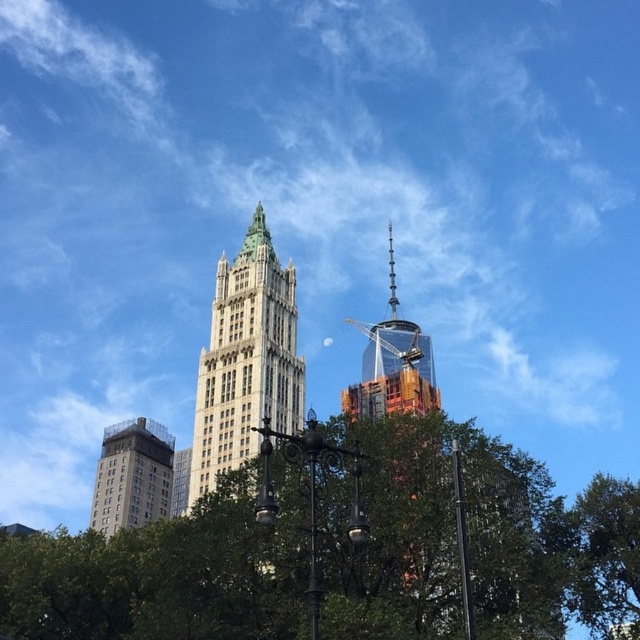
Does green leafy tree at center appear over white stone tower at center?

No, green leafy tree at center is not above white stone tower at center.

Who is higher up, green leafy tree at center or white stone tower at center?

white stone tower at center is higher up.

Find the location of a particular element. Image resolution: width=640 pixels, height=640 pixels. green leafy tree at center is located at coordinates (472, 540).

I want to click on green leafy tree at center, so click(x=472, y=540).

Looking at this image, does white stone tower at center have a greater width compared to orange glass tower at upper center?

Correct, the width of white stone tower at center exceeds that of orange glass tower at upper center.

Where is `white stone tower at center`? The image size is (640, 640). white stone tower at center is located at coordinates (246, 360).

Which is below, green leafy tree at center or orange glass tower at upper center?

green leafy tree at center is below.

From the picture: Does green leafy tree at center have a greater height compared to orange glass tower at upper center?

No.

Find the location of `green leafy tree at center`. green leafy tree at center is located at coordinates (472, 540).